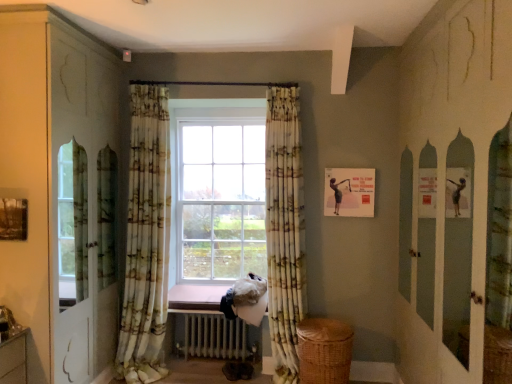
Describe the element at coordinates (146, 239) in the screenshot. I see `floral fabric curtain at center, placed as the 2th curtain when sorted from right to left` at that location.

The width and height of the screenshot is (512, 384). Find the location of `white metallic radiator at center`. white metallic radiator at center is located at coordinates (213, 336).

Consider the image. In order to face white glossy dresser at left, should I rotate leftwards or rightwards?

Turn left approximately 25.536 degrees to face it.

The width and height of the screenshot is (512, 384). Describe the element at coordinates (196, 296) in the screenshot. I see `pink wood at center` at that location.

Image resolution: width=512 pixels, height=384 pixels. What do you see at coordinates (349, 192) in the screenshot? I see `matte paper picture frame at upper right` at bounding box center [349, 192].

Locate an element on the screen. matte paper picture frame at upper right is located at coordinates (349, 192).

In order to click on woven brown basket at lower right in this screenshot , I will do `click(324, 351)`.

I want to click on floral fabric curtain at center, placed as the 2th curtain when sorted from right to left, so click(x=146, y=239).

Considering the positions of point (295, 197) and point (229, 340), is point (295, 197) closer or farther from the camera than point (229, 340)?

Point (295, 197) appears to be closer to the viewer than point (229, 340).

Considering their positions, is printed fabric curtain at center, positioned as the second curtain in left-to-right order, located in front of or behind white metallic radiator at center?

printed fabric curtain at center, positioned as the second curtain in left-to-right order, is in front of white metallic radiator at center.

Can you confirm if printed fabric curtain at center, positioned as the second curtain in left-to-right order, is thinner than white metallic radiator at center?

Correct, the width of printed fabric curtain at center, positioned as the second curtain in left-to-right order, is less than that of white metallic radiator at center.

Is printed fabric curtain at center, positioned as the second curtain in left-to-right order, to the left of white metallic radiator at center from the viewer's perspective?

Incorrect, printed fabric curtain at center, positioned as the second curtain in left-to-right order, is not on the left side of white metallic radiator at center.

Is floral fabric curtain at center, which appears as the 1th curtain when viewed from the left, a part of white metallic radiator at center?

No, floral fabric curtain at center, which appears as the 1th curtain when viewed from the left, is located outside of white metallic radiator at center.

Is the surface of white metallic radiator at center in direct contact with floral fabric curtain at center, which appears as the 1th curtain when viewed from the left?

No, white metallic radiator at center is not in contact with floral fabric curtain at center, which appears as the 1th curtain when viewed from the left.

Is white metallic radiator at center taller than floral fabric curtain at center, which appears as the 1th curtain when viewed from the left?

In fact, white metallic radiator at center may be shorter than floral fabric curtain at center, which appears as the 1th curtain when viewed from the left.

Does white metallic radiator at center lie behind floral fabric curtain at center, placed as the 2th curtain when sorted from right to left?

Yes, white metallic radiator at center is further from the camera.

Can you confirm if pink wood at center is shorter than woven brown basket at lower right?

Indeed, pink wood at center has a lesser height compared to woven brown basket at lower right.

Are pink wood at center and woven brown basket at lower right located far from each other?

Yes, pink wood at center and woven brown basket at lower right are quite far apart.

From the image's perspective, is pink wood at center located above or below woven brown basket at lower right?

pink wood at center is situated higher than woven brown basket at lower right in the image.

From a real-world perspective, is white glossy dresser at left above or below floral fabric curtain at center, which appears as the 1th curtain when viewed from the left?

From a real-world perspective, white glossy dresser at left is physically above floral fabric curtain at center, which appears as the 1th curtain when viewed from the left.

Is white glossy dresser at left closer to camera compared to floral fabric curtain at center, placed as the 2th curtain when sorted from right to left?

Yes.

Would you say white glossy dresser at left is a long distance from floral fabric curtain at center, placed as the 2th curtain when sorted from right to left?

No, white glossy dresser at left is not far away from floral fabric curtain at center, placed as the 2th curtain when sorted from right to left.

Can you confirm if white glossy dresser at left is shorter than floral fabric curtain at center, which appears as the 1th curtain when viewed from the left?

No.

Looking at this image, is white glossy dresser at left oriented towards printed fabric curtain at center, positioned as the second curtain in left-to-right order?

Yes, white glossy dresser at left is turned towards printed fabric curtain at center, positioned as the second curtain in left-to-right order.

Is white glossy dresser at left located outside printed fabric curtain at center, which appears as the first curtain when viewed from the right?

That's correct, white glossy dresser at left is outside of printed fabric curtain at center, which appears as the first curtain when viewed from the right.

From a real-world perspective, is white glossy dresser at left positioned over printed fabric curtain at center, positioned as the second curtain in left-to-right order, based on gravity?

Indeed, from a real-world perspective, white glossy dresser at left stands above printed fabric curtain at center, positioned as the second curtain in left-to-right order.

Considering the relative positions of matte paper picture frame at upper right and floral fabric curtain at center, which appears as the 1th curtain when viewed from the left, in the image provided, is matte paper picture frame at upper right to the left or to the right of floral fabric curtain at center, which appears as the 1th curtain when viewed from the left,?

In the image, matte paper picture frame at upper right appears on the right side of floral fabric curtain at center, which appears as the 1th curtain when viewed from the left.

Starting from the matte paper picture frame at upper right, which curtain is the 1st one in front? Please provide its 2D coordinates.

[(146, 239)]

Is matte paper picture frame at upper right thinner than floral fabric curtain at center, placed as the 2th curtain when sorted from right to left?

Indeed, matte paper picture frame at upper right has a lesser width compared to floral fabric curtain at center, placed as the 2th curtain when sorted from right to left.

Is matte paper picture frame at upper right facing away from floral fabric curtain at center, which appears as the 1th curtain when viewed from the left?

matte paper picture frame at upper right does not have its back to floral fabric curtain at center, which appears as the 1th curtain when viewed from the left.

What's the angular difference between matte paper picture frame at upper right and printed fabric curtain at center, which appears as the first curtain when viewed from the right,'s facing directions?

matte paper picture frame at upper right and printed fabric curtain at center, which appears as the first curtain when viewed from the right, are facing 3.53 degrees away from each other.

Is point (365, 175) more distant than point (296, 187)?

Yes, point (365, 175) is farther from viewer.

Where is `the 2nd curtain below when counting from the matte paper picture frame at upper right (from the image's perspective)`? the 2nd curtain below when counting from the matte paper picture frame at upper right (from the image's perspective) is located at coordinates click(x=284, y=229).

Does matte paper picture frame at upper right have a lesser width compared to printed fabric curtain at center, positioned as the second curtain in left-to-right order?

Correct, the width of matte paper picture frame at upper right is less than that of printed fabric curtain at center, positioned as the second curtain in left-to-right order.

Find the location of a particular element. The image size is (512, 384). radiator below the printed fabric curtain at center, positioned as the second curtain in left-to-right order (from the image's perspective) is located at coordinates (213, 336).

In order to click on radiator on the right of floral fabric curtain at center, which appears as the 1th curtain when viewed from the left in this screenshot , I will do `click(213, 336)`.

Estimate the real-world distances between objects in this image. Which object is further from white metallic radiator at center, printed fabric curtain at center, positioned as the second curtain in left-to-right order, or floral fabric curtain at center, placed as the 2th curtain when sorted from right to left?

Based on the image, printed fabric curtain at center, positioned as the second curtain in left-to-right order, appears to be further to white metallic radiator at center.

Which object lies further to the anchor point matte paper picture frame at upper right, white glossy dresser at left or pink wood at center?

white glossy dresser at left lies further to matte paper picture frame at upper right than the other object.

From the image, which object appears to be farther from matte paper picture frame at upper right, white glossy dresser at left or printed fabric curtain at center, which appears as the first curtain when viewed from the right?

white glossy dresser at left is positioned further to the anchor matte paper picture frame at upper right.

Which object lies further to the anchor point pink wood at center, white glossy dresser at left or white metallic radiator at center?

The object further to pink wood at center is white glossy dresser at left.

Estimate the real-world distances between objects in this image. Which object is closer to pink wood at center, white glossy dresser at left or woven brown basket at lower right?

Among the two, woven brown basket at lower right is located nearer to pink wood at center.

When comparing their distances from pink wood at center, does matte paper picture frame at upper right or white metallic radiator at center seem closer?

Based on the image, white metallic radiator at center appears to be nearer to pink wood at center.

When comparing their distances from white glossy dresser at left, does white metallic radiator at center or woven brown basket at lower right seem closer?

white metallic radiator at center is positioned closer to the anchor white glossy dresser at left.

When comparing their distances from white metallic radiator at center, does floral fabric curtain at center, placed as the 2th curtain when sorted from right to left, or woven brown basket at lower right seem closer?

floral fabric curtain at center, placed as the 2th curtain when sorted from right to left, lies closer to white metallic radiator at center than the other object.

Locate an element on the screen. The image size is (512, 384). window sill situated between white glossy dresser at left and printed fabric curtain at center, positioned as the second curtain in left-to-right order, from left to right is located at coordinates (196, 296).

Where is `basket located between floral fabric curtain at center, placed as the 2th curtain when sorted from right to left, and matte paper picture frame at upper right in the left-right direction`? basket located between floral fabric curtain at center, placed as the 2th curtain when sorted from right to left, and matte paper picture frame at upper right in the left-right direction is located at coordinates (324, 351).

In order to click on curtain between pink wood at center and matte paper picture frame at upper right in this screenshot , I will do `click(284, 229)`.

Where is `curtain situated between white glossy dresser at left and pink wood at center from left to right`? This screenshot has width=512, height=384. curtain situated between white glossy dresser at left and pink wood at center from left to right is located at coordinates (146, 239).